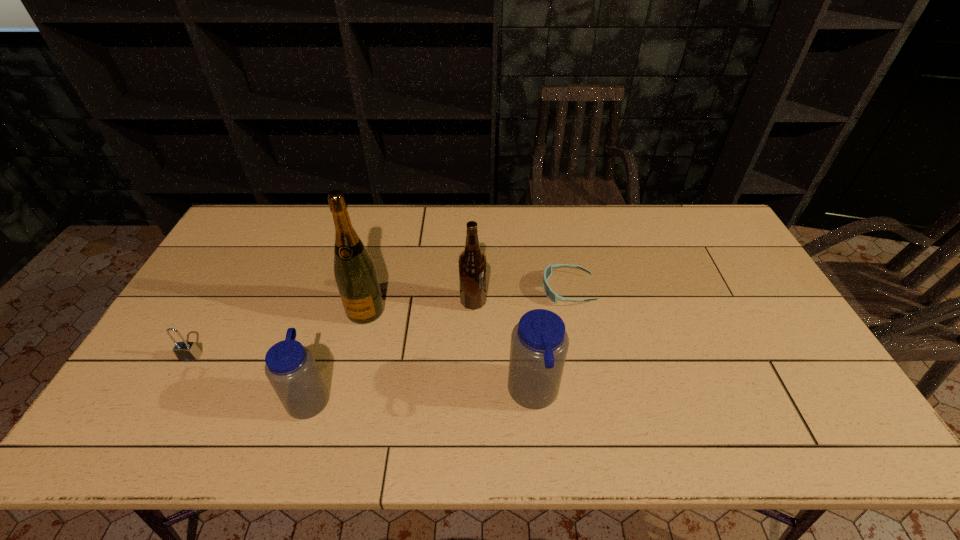
The image size is (960, 540). In the image, there is a desktop. Identify the location of free space at the far edge. (622, 236).

You are a GUI agent. You are given a task and a screenshot of the screen. Output one action in this format:
    pyautogui.click(x=<x>, y=<y>)
    Task: Click on the vacant region at the near edge of the desktop
    
    Given the screenshot: What is the action you would take?
    [592, 392]

This screenshot has height=540, width=960. Identify the location of vacant space at the left edge of the desktop. (238, 285).

At what (x,y) coordinates should I click in order to perform the action: click on free space at the right edge of the desktop. Please return your answer as a coordinate pair (x, y). Looking at the image, I should click on (761, 314).

Locate an element on the screen. vacant area between the third nearest object and the goggles is located at coordinates (379, 323).

You are a GUI agent. You are given a task and a screenshot of the screen. Output one action in this format:
    pyautogui.click(x=<x>, y=<y>)
    Task: Click on the free space between the left water bottle and the leftmost object
    This screenshot has width=960, height=540.
    Given the screenshot: What is the action you would take?
    pyautogui.click(x=251, y=377)

Where is `vacant area that lies between the goggles and the fifth tallest object`? Image resolution: width=960 pixels, height=540 pixels. vacant area that lies between the goggles and the fifth tallest object is located at coordinates (379, 323).

In order to click on blank region between the padlock and the beer bottle in this screenshot , I will do `click(332, 329)`.

Image resolution: width=960 pixels, height=540 pixels. I want to click on vacant space that is in between the shortest object and the third nearest object, so click(x=379, y=323).

Where is `free space between the fourth shortest object and the third shortest object`? free space between the fourth shortest object and the third shortest object is located at coordinates (421, 396).